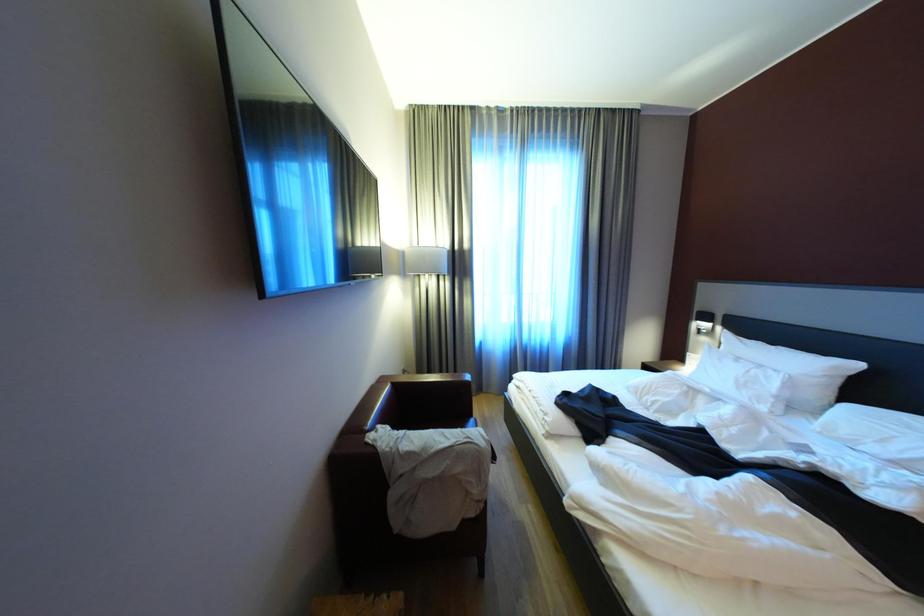
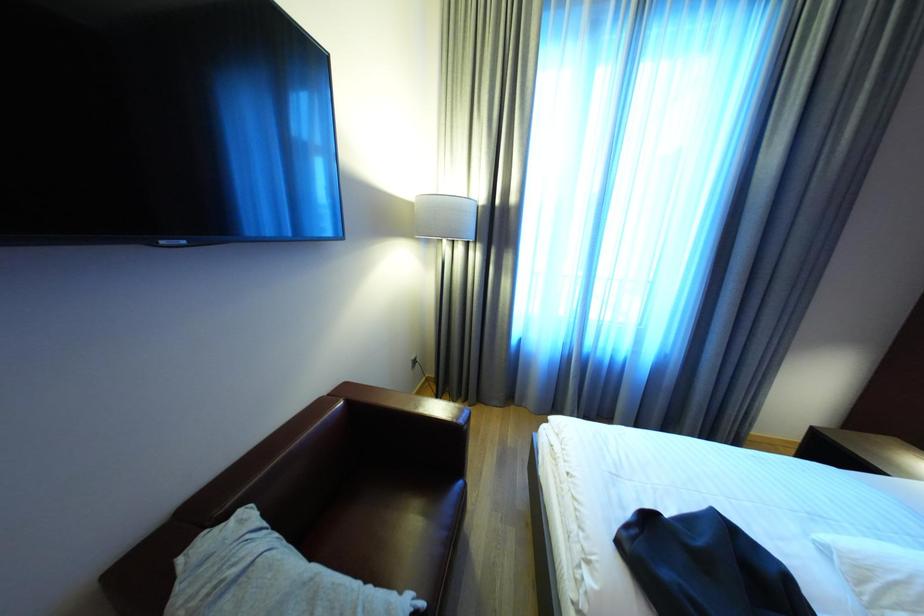
Question: The images are taken continuously from a first-person perspective. In which direction is your viewpoint rotating?

Choices:
 (A) Left
 (B) Right
 (C) Up
 (D) Down

Answer: (A)